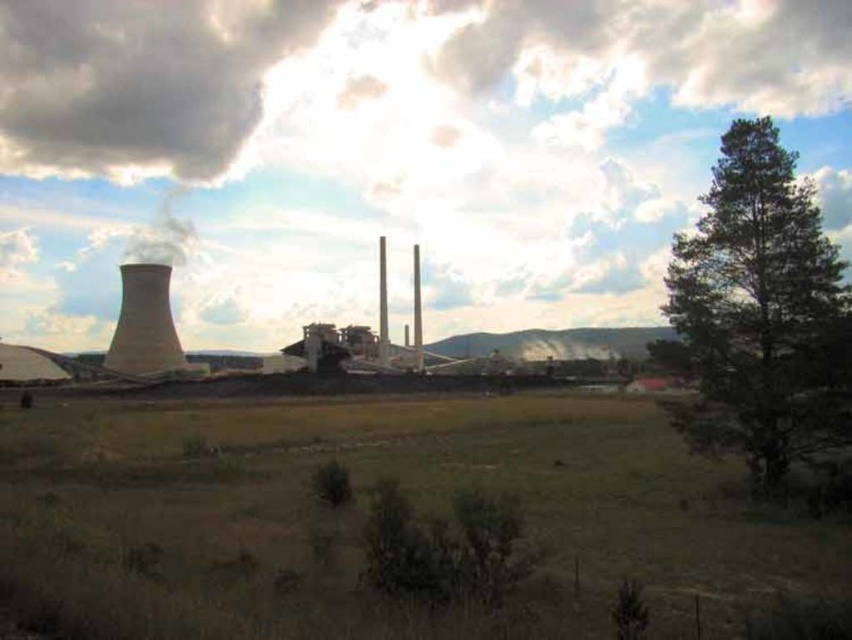
Between green leafy tree at right and smooth concrete chimney at left, which one appears on the left side from the viewer's perspective?

smooth concrete chimney at left

Can you confirm if green leafy tree at right is smaller than smooth concrete chimney at left?

Yes, green leafy tree at right is smaller than smooth concrete chimney at left.

Which is behind, point (727, 214) or point (124, 296)?

Positioned behind is point (124, 296).

Where is `green leafy tree at right`? green leafy tree at right is located at coordinates (758, 314).

Can you confirm if green grass at center is shorter than dark gray cloud at upper left?

Correct, green grass at center is not as tall as dark gray cloud at upper left.

Who is more distant from viewer, (550, 614) or (121, 131)?

The point (121, 131) is behind.

Where is `green grass at center`? The height and width of the screenshot is (640, 852). green grass at center is located at coordinates (364, 515).

Which is behind, point (272, 298) or point (110, 360)?

Positioned behind is point (272, 298).

Measure the distance between white fluffy cloud at upper center and smooth concrete chimney at left.

504.53 feet

Is point (392, 109) farther from camera compared to point (153, 268)?

Yes.

At what (x,y) coordinates should I click in order to perform the action: click on white fluffy cloud at upper center. Please return your answer as a coordinate pair (x, y). Image resolution: width=852 pixels, height=640 pixels. Looking at the image, I should click on (387, 154).